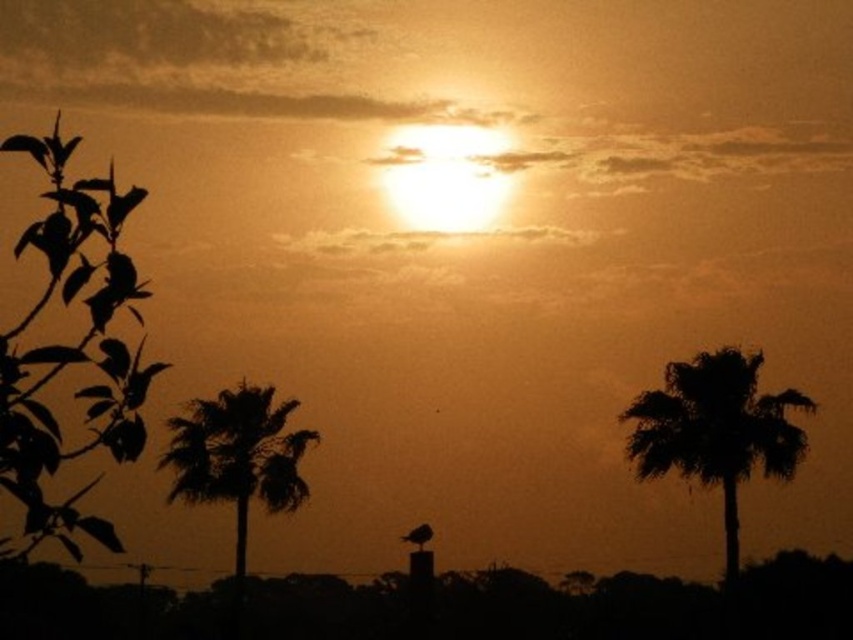
Question: Which object is closer to the camera taking this photo?

Choices:
 (A) silhouette palm tree at right
 (B) green leafy plant at left
 (C) silhouette palm tree at left

Answer: (B)

Question: Can you confirm if green leafy plant at left is positioned below silhouette palm tree at right?

Choices:
 (A) no
 (B) yes

Answer: (B)

Question: Can you confirm if green leafy plant at left is positioned below silhouette palm tree at left?

Choices:
 (A) yes
 (B) no

Answer: (B)

Question: Does silhouette palm tree at right have a greater width compared to silhouette palm tree at left?

Choices:
 (A) yes
 (B) no

Answer: (A)

Question: Estimate the real-world distances between objects in this image. Which object is closer to the silhouette palm tree at left?

Choices:
 (A) silhouette palm tree at right
 (B) green leafy plant at left

Answer: (A)

Question: Which point is farther to the camera?

Choices:
 (A) silhouette palm tree at left
 (B) green leafy plant at left
 (C) silhouette palm tree at right

Answer: (A)